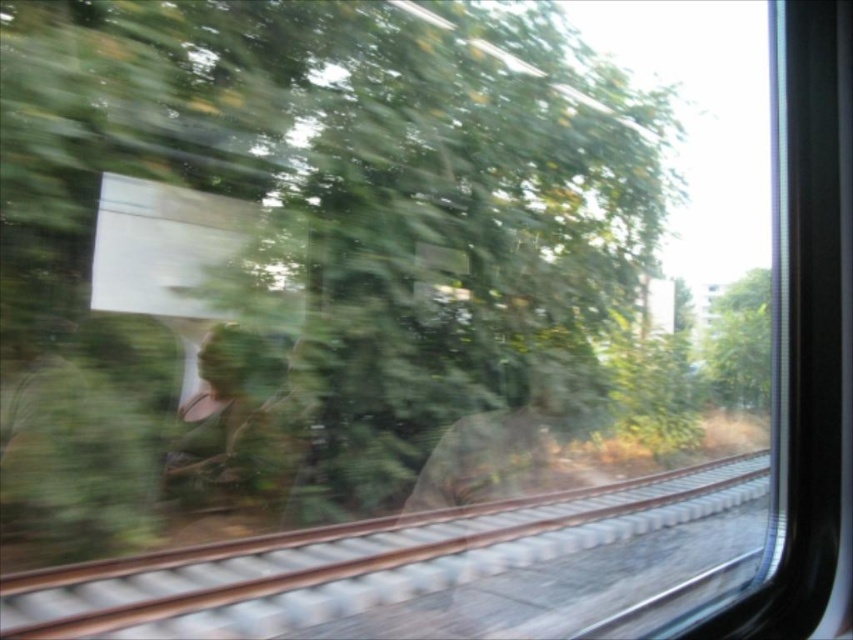
Can you confirm if brown metal track at lower center is wider than green leafy tree at right?

Indeed, brown metal track at lower center has a greater width compared to green leafy tree at right.

Is point (351, 573) closer to camera compared to point (749, 342)?

Yes, point (351, 573) is in front of point (749, 342).

Identify the location of brown metal track at lower center. The image size is (853, 640). (355, 561).